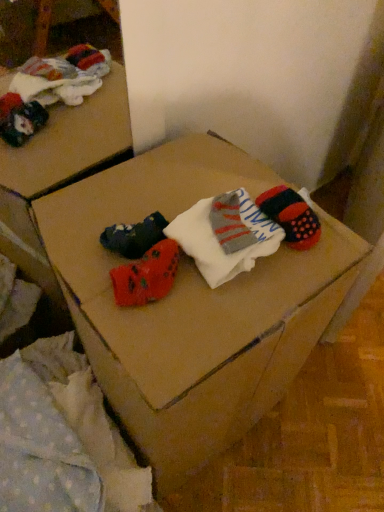
Question: From the image's perspective, is light blue polka dot fabric at lower left located above or below white soft socks at center?

Choices:
 (A) above
 (B) below

Answer: (B)

Question: From a real-world perspective, relative to white soft socks at center, is light blue polka dot fabric at lower left vertically above or below?

Choices:
 (A) above
 (B) below

Answer: (B)

Question: Which of these objects is positioned closest to the light blue polka dot fabric at lower left?

Choices:
 (A) white soft socks at center
 (B) cardboard box at center

Answer: (B)

Question: Which is farther from the light blue polka dot fabric at lower left?

Choices:
 (A) white soft socks at center
 (B) cardboard box at center

Answer: (A)